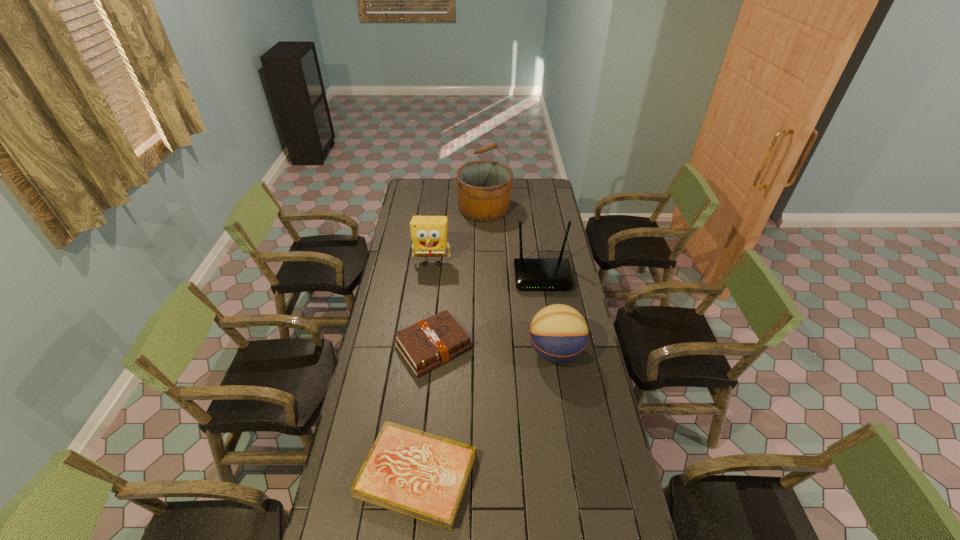
Where is `object that stands as the closest to the sponge`? object that stands as the closest to the sponge is located at coordinates (484, 187).

Select which object is the fifth closest to the nearest object. Please provide its 2D coordinates. Your answer should be formatted as a tuple, i.e. [(x, y)], where the tuple contains the x and y coordinates of a point satisfying the conditions above.

[(484, 187)]